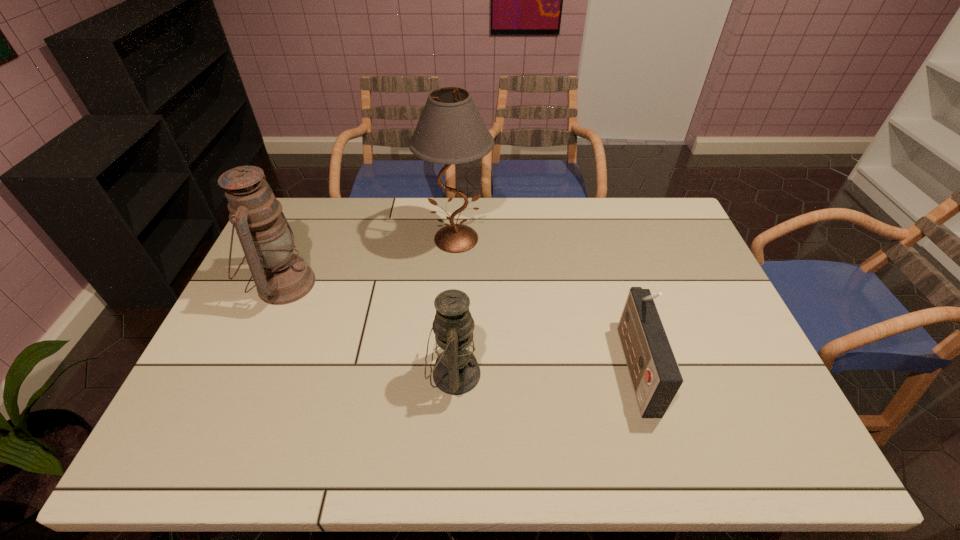
In order to click on vacant space situated 0.160m on the front panel of the radio receiver in this screenshot , I will do `click(563, 365)`.

The height and width of the screenshot is (540, 960). In order to click on free point located 0.160m on the front panel of the radio receiver in this screenshot , I will do `click(563, 365)`.

Find the location of a particular element. The height and width of the screenshot is (540, 960). object situated at the far edge is located at coordinates (450, 130).

Identify the location of object positioned at the left edge. This screenshot has width=960, height=540. (281, 277).

Where is `free space at the far edge of the desktop`? This screenshot has width=960, height=540. free space at the far edge of the desktop is located at coordinates (382, 234).

Where is `free region at the near edge of the desktop`? The image size is (960, 540). free region at the near edge of the desktop is located at coordinates (596, 432).

At what (x,y) coordinates should I click in order to perform the action: click on free space at the left edge of the desktop. Please return your answer as a coordinate pair (x, y). Image resolution: width=960 pixels, height=540 pixels. Looking at the image, I should click on (239, 304).

The image size is (960, 540). Identify the location of vacant space at the right edge of the desktop. (682, 245).

Find the location of a particular element. The height and width of the screenshot is (540, 960). free space at the far left corner of the desktop is located at coordinates (302, 204).

In the image, there is a desktop. Identify the location of vacant space at the far right corner. This screenshot has height=540, width=960. (632, 204).